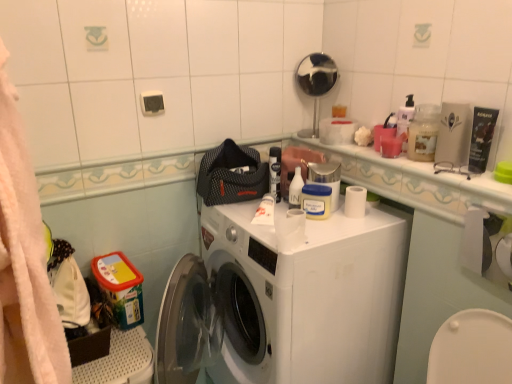
Locate an element on the screen. This screenshot has width=512, height=384. free space in front of white plastic bottle at upper center, arranged as the 5th toiletry when viewed from the right is located at coordinates (316, 231).